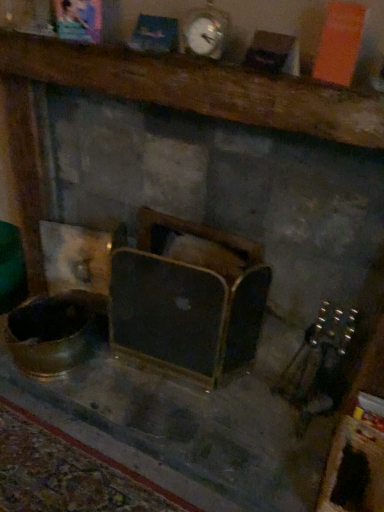
I want to click on vacant space situated on the left part of wooden framed mirror at center, which is counted as the 2th furniture, starting from the top, so click(119, 374).